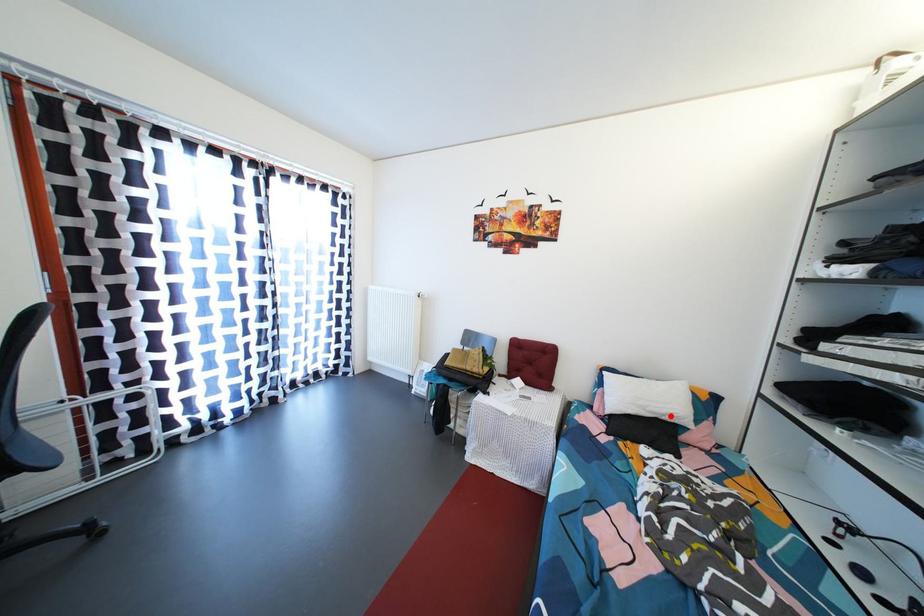
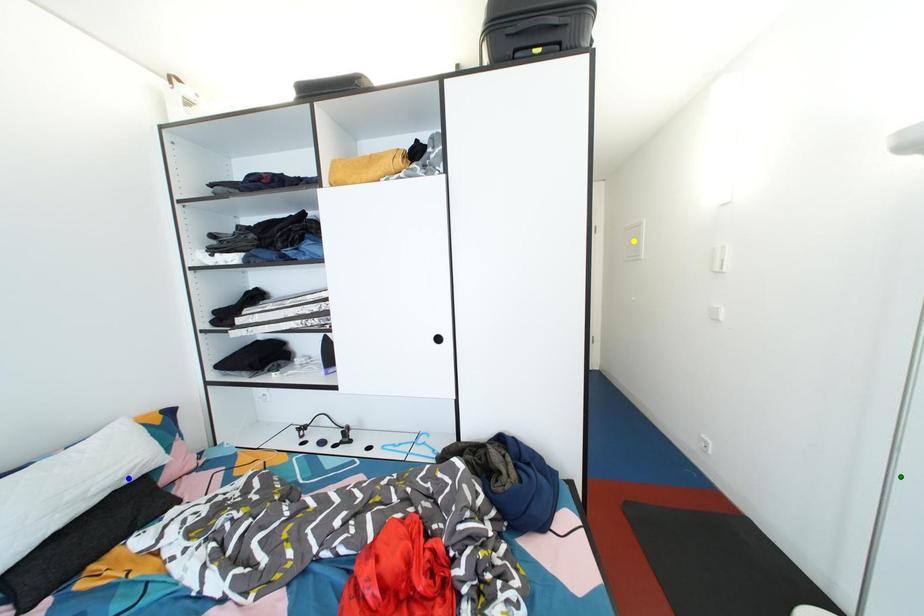
Question: I am providing you with two images of the same scene from different viewpoints. A red point is marked on the first image. You are given multiple points on the second image. Can you choose the point in image 2 that corresponds to the point in image 1?

Choices:
 (A) green point
 (B) blue point
 (C) yellow point

Answer: (B)